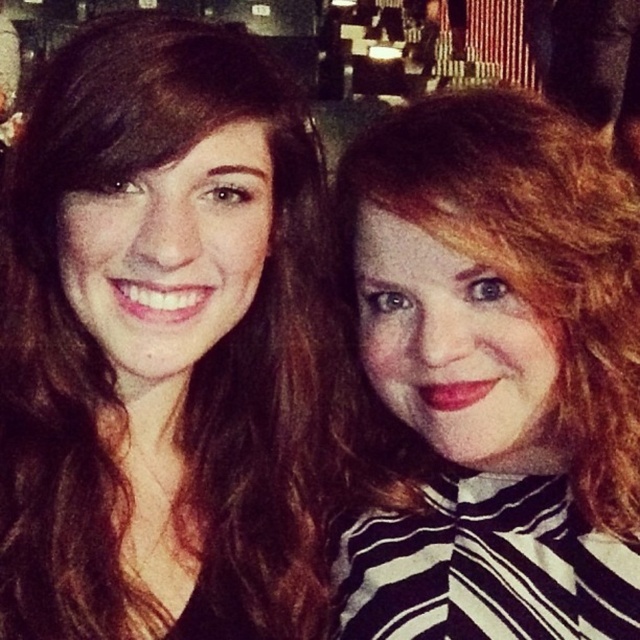
Between matte black hair at left and matte black hair at right, which one is positioned lower?

matte black hair at right

Is matte black hair at left taller than matte black hair at right?

Yes, matte black hair at left is taller than matte black hair at right.

Which is behind, point (288, 272) or point (472, 224)?

Positioned behind is point (288, 272).

Find the location of a particular element. matte black hair at left is located at coordinates (164, 340).